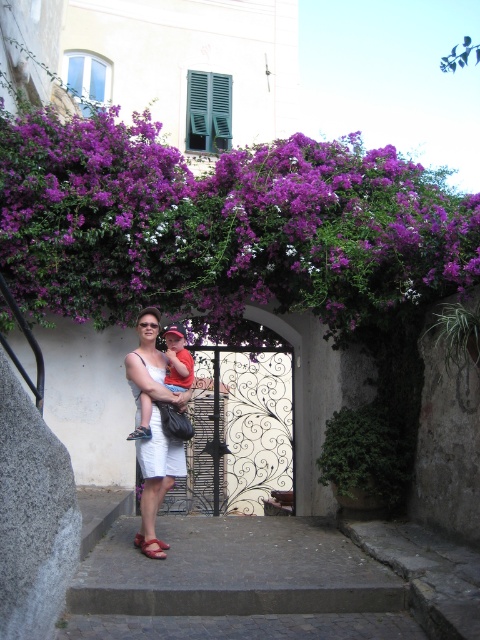
Question: Is white cotton shorts at center to the left of matte red shirt at center from the viewer's perspective?

Choices:
 (A) yes
 (B) no

Answer: (A)

Question: Does purple matte flowers at upper center appear on the right side of white cotton shorts at center?

Choices:
 (A) yes
 (B) no

Answer: (A)

Question: Which point is farther to the camera?

Choices:
 (A) (167, 547)
 (B) (273, 218)
 (C) (157, 326)

Answer: (B)

Question: Which point appears closest to the camera in this image?

Choices:
 (A) (x=339, y=241)
 (B) (x=163, y=541)

Answer: (B)

Question: Is white cotton shorts at center to the right of matte red shirt at center from the viewer's perspective?

Choices:
 (A) no
 (B) yes

Answer: (A)

Question: Which point appears farthest from the camera in this image?

Choices:
 (A) (229, 168)
 (B) (147, 340)
 (C) (156, 540)
 (D) (169, 342)

Answer: (A)